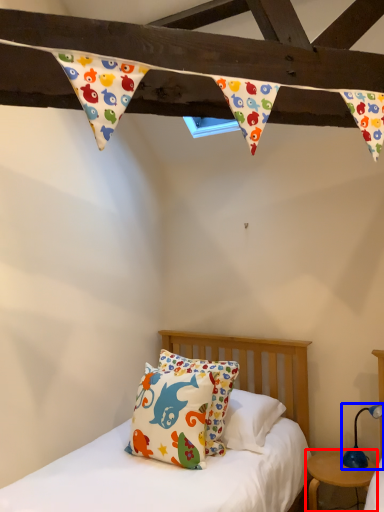
Question: Which object is further to the camera taking this photo, nightstand (highlighted by a red box) or table lamp (highlighted by a blue box)?

Choices:
 (A) nightstand
 (B) table lamp

Answer: (B)